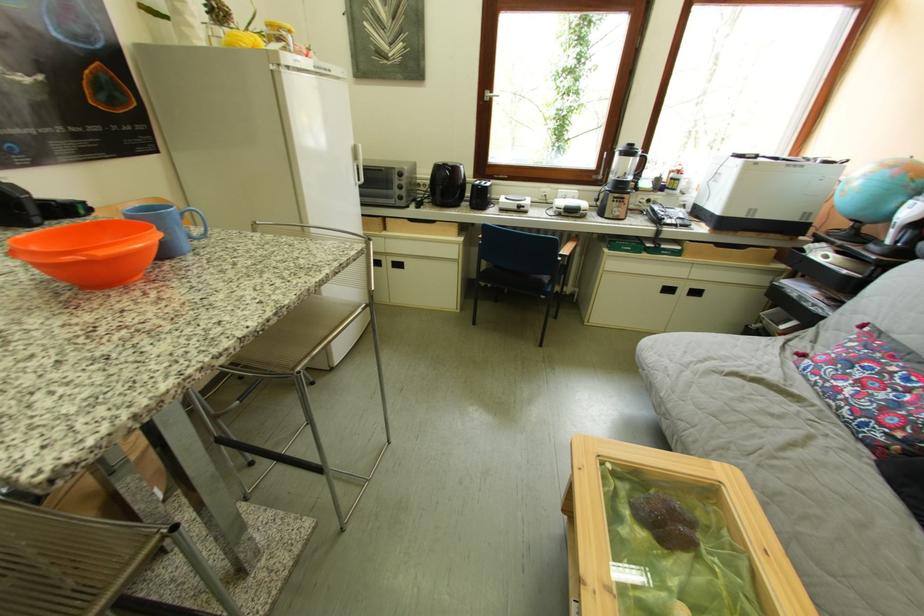
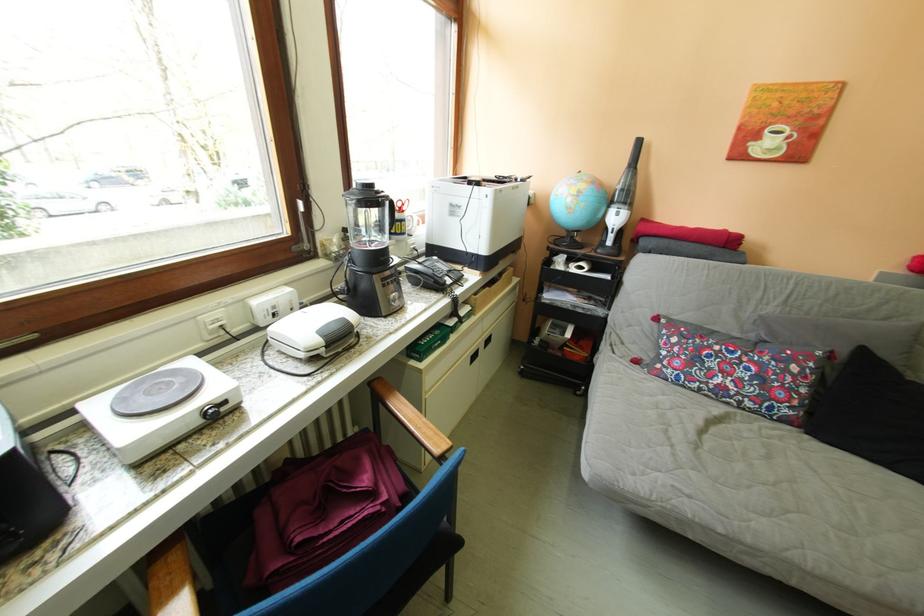
In the second image, find the point that corresponds to point 891,466 in the first image.

(821, 437)